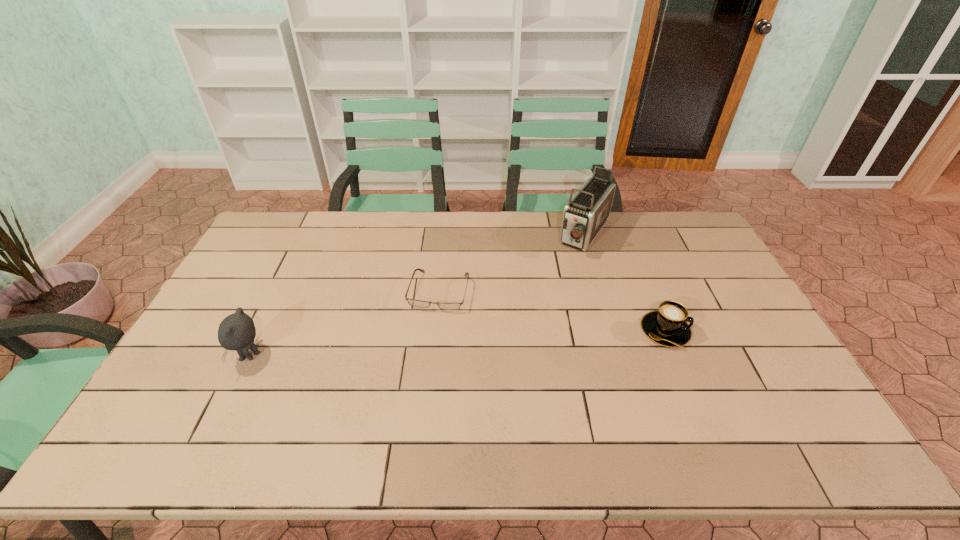
Where is `the second tallest object`? the second tallest object is located at coordinates (237, 331).

This screenshot has width=960, height=540. What are the coordinates of `kitten` in the screenshot? It's located at (237, 331).

The width and height of the screenshot is (960, 540). I want to click on cappuccino, so click(x=667, y=326).

Locate an element on the screen. The width and height of the screenshot is (960, 540). spectacles is located at coordinates coord(413,302).

Where is `the third object from right to left`? The width and height of the screenshot is (960, 540). the third object from right to left is located at coordinates (413, 302).

The image size is (960, 540). Find the location of `the farthest object`. the farthest object is located at coordinates (585, 214).

You are a GUI agent. You are given a task and a screenshot of the screen. Output one action in this format:
    pyautogui.click(x=<x>, y=<y>)
    Task: Click on the camcorder
    This screenshot has width=960, height=540.
    Given the screenshot: What is the action you would take?
    pyautogui.click(x=585, y=214)

What are the coordinates of `free space located 0.050m on the front-facing side of the second tallest object` in the screenshot? It's located at (216, 355).

Find the location of `free space located on the left of the third tallest object`. free space located on the left of the third tallest object is located at coordinates (572, 332).

Find the location of `vacant space situated on the front-facing side of the third object from right to left`. vacant space situated on the front-facing side of the third object from right to left is located at coordinates (417, 373).